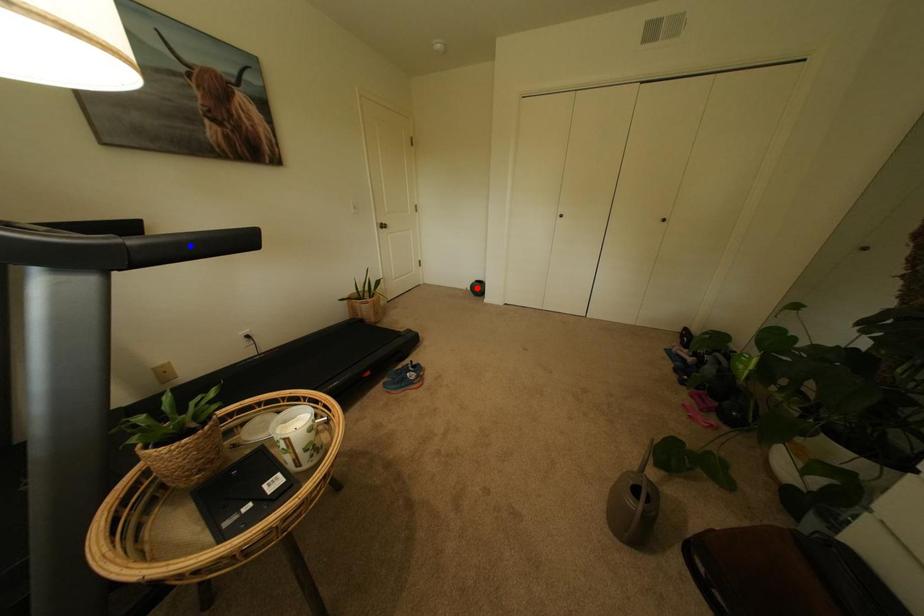
Question: In the image, two points are highlighted. Which point is nearer to the camera? Reply with the corresponding letter.

Choices:
 (A) blue point
 (B) red point

Answer: (A)